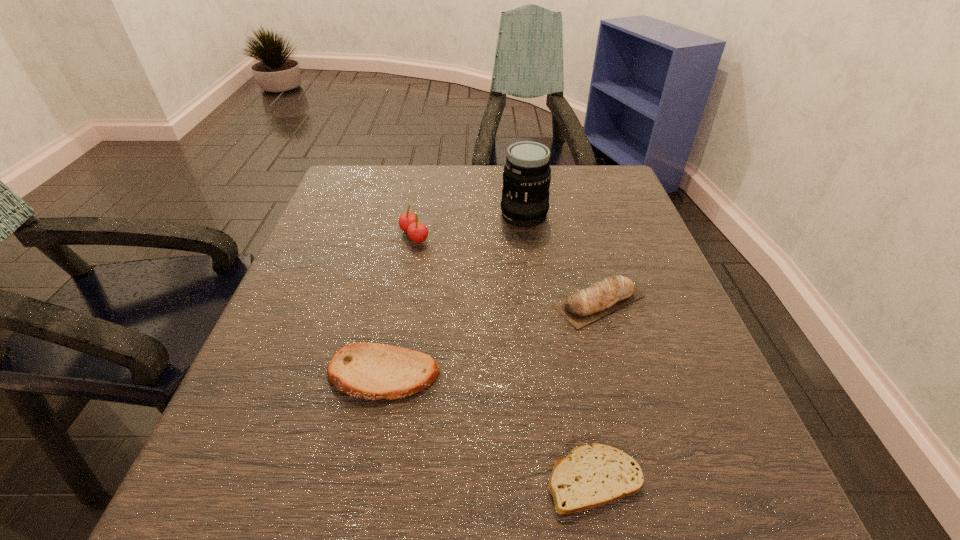
Identify the location of the tallest object. (526, 177).

You are a GUI agent. You are given a task and a screenshot of the screen. Output one action in this format:
    pyautogui.click(x=<x>, y=<y>)
    Task: Click on the cherry
    
    Given the screenshot: What is the action you would take?
    pyautogui.click(x=408, y=222)

The width and height of the screenshot is (960, 540). What are the coordinates of `the third nearest object` in the screenshot? It's located at (601, 298).

The image size is (960, 540). Find the location of `the third tallest object`. the third tallest object is located at coordinates (601, 298).

I want to click on the second nearest object, so pos(371,371).

This screenshot has width=960, height=540. I want to click on the second nearest pita bread, so click(371, 371).

The image size is (960, 540). What are the coordinates of `the shortest object` in the screenshot? It's located at (594, 475).

Identify the location of the nearest pita bread. (594, 475).

The width and height of the screenshot is (960, 540). What are the coordinates of `free space located 0.370m on the left of the tallest object` in the screenshot? It's located at (342, 215).

Find the location of a particular element. free region located 0.350m on the front of the second tallest object is located at coordinates (386, 390).